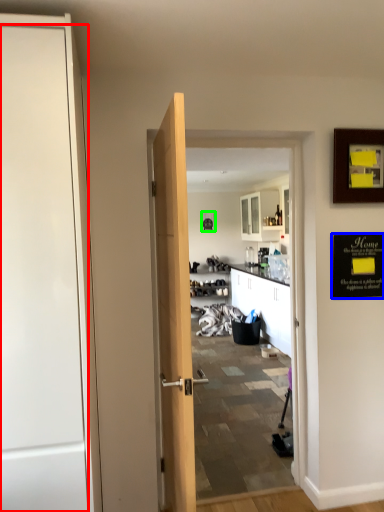
Question: Which object is the farthest from door (highlighted by a red box)? Choose among these: bulletin board (highlighted by a blue box) or picture frame (highlighted by a green box).

Choices:
 (A) bulletin board
 (B) picture frame

Answer: (B)